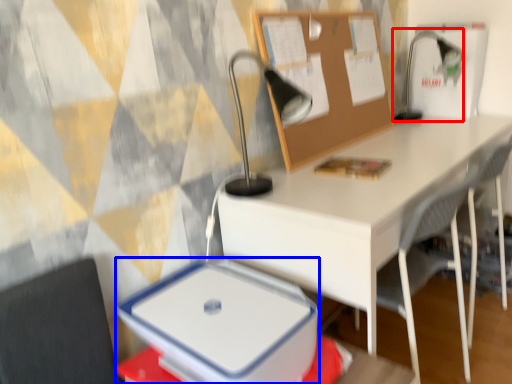
Question: Which point is further to the camera, table lamp (highlighted by a red box) or lunch box (highlighted by a blue box)?

Choices:
 (A) table lamp
 (B) lunch box

Answer: (A)